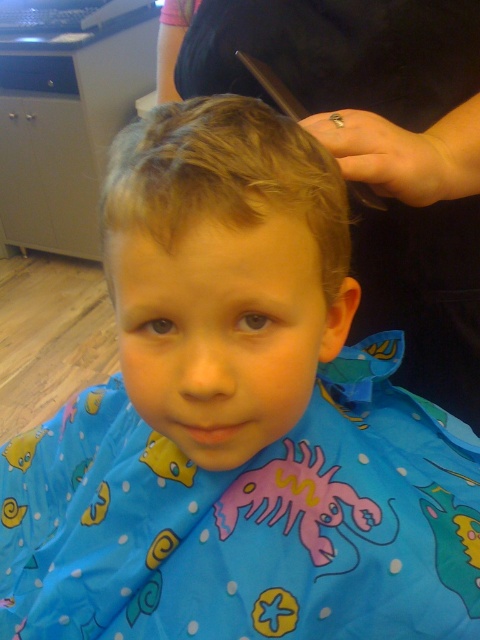
Between black fabric at upper center and blonde smooth hair at center, which one appears on the right side from the viewer's perspective?

From the viewer's perspective, black fabric at upper center appears more on the right side.

Is point (476, 269) closer to camera compared to point (180, 102)?

No.

The height and width of the screenshot is (640, 480). Find the location of `black fabric at upper center`. black fabric at upper center is located at coordinates (373, 150).